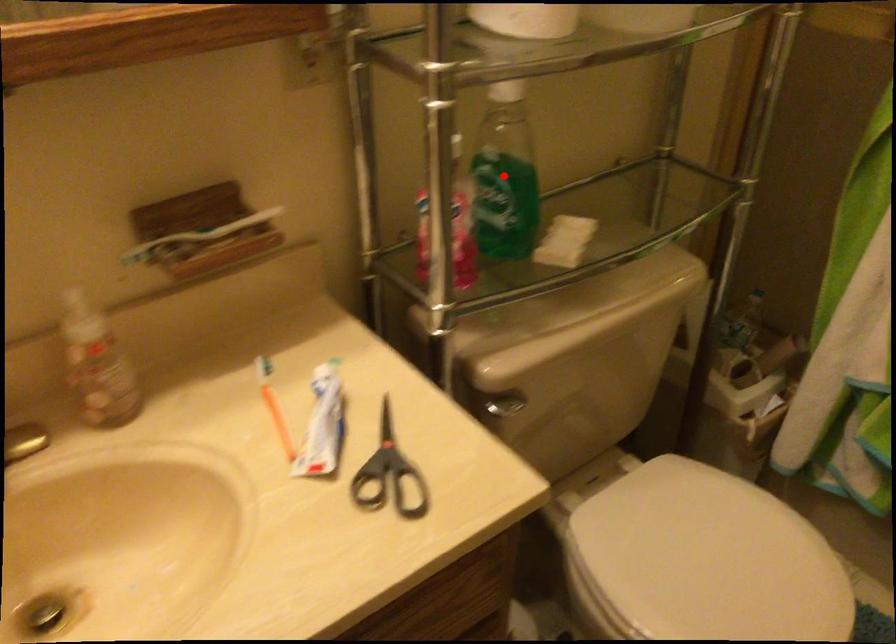
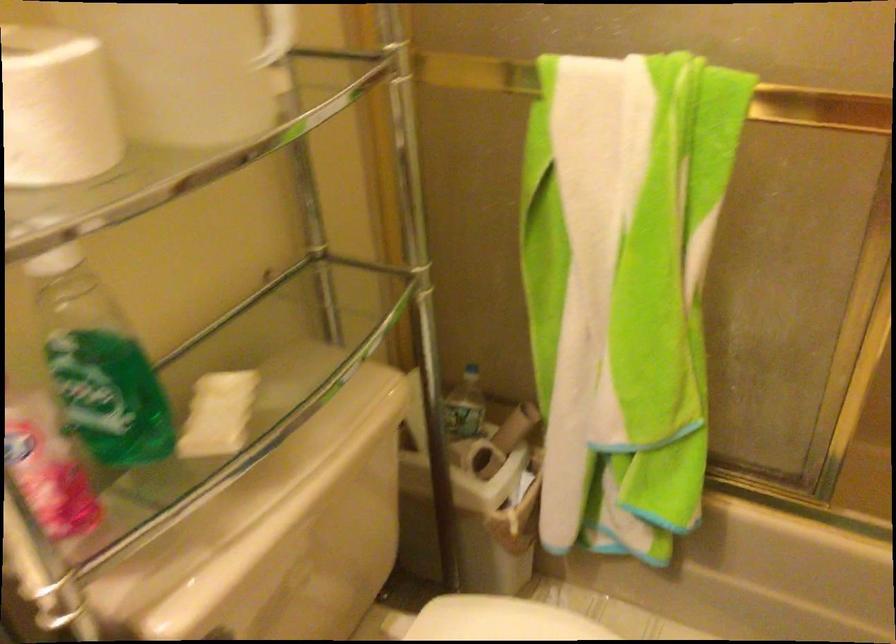
Question: I am providing you with two images of the same scene from different viewpoints. A red point is marked on the first image. At the location where the point appears in image 1, is it still visible in image 2?

Choices:
 (A) Yes
 (B) No

Answer: (A)